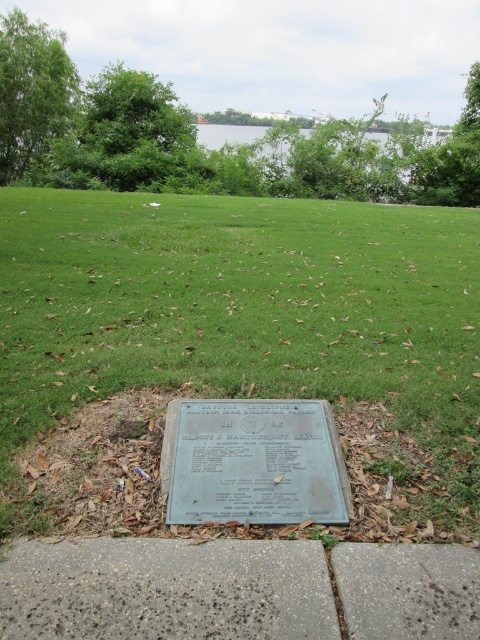
Question: Which point is farther to the camera?

Choices:
 (A) (183, 637)
 (B) (445, 403)
 (C) (291, 497)

Answer: (B)

Question: Can you confirm if green grass at center is positioned above gray concrete pavement at lower center?

Choices:
 (A) yes
 (B) no

Answer: (A)

Question: From the image, what is the correct spatial relationship of green grass at center in relation to gray concrete pavement at lower center?

Choices:
 (A) below
 (B) above

Answer: (B)

Question: Which is farther from the green grass at center?

Choices:
 (A) green polished stone plaque at center
 (B) gray concrete pavement at lower center

Answer: (B)

Question: Can you confirm if gray concrete pavement at lower center is positioned below green polished stone plaque at center?

Choices:
 (A) yes
 (B) no

Answer: (A)

Question: Which object is closer to the camera taking this photo?

Choices:
 (A) green polished stone plaque at center
 (B) green grass at center
 (C) gray concrete pavement at lower center

Answer: (C)